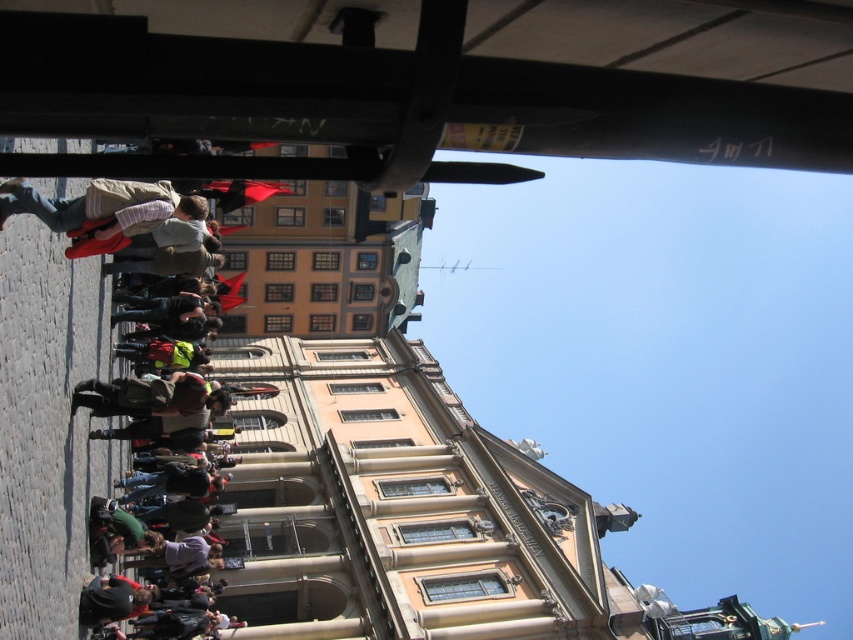
Does metallic black canopy at upper center appear under striped shirt at left?

Incorrect, metallic black canopy at upper center is not positioned below striped shirt at left.

The height and width of the screenshot is (640, 853). What are the coordinates of `metallic black canopy at upper center` in the screenshot? It's located at (428, 83).